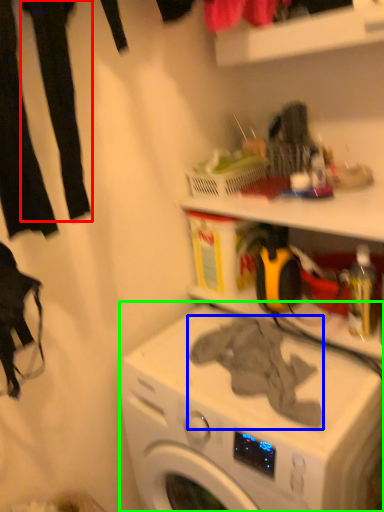
Question: Which object is the closest to the clothing (highlighted by a red box)? Choose among these: clothing (highlighted by a blue box) or washing machine (highlighted by a green box).

Choices:
 (A) clothing
 (B) washing machine

Answer: (A)